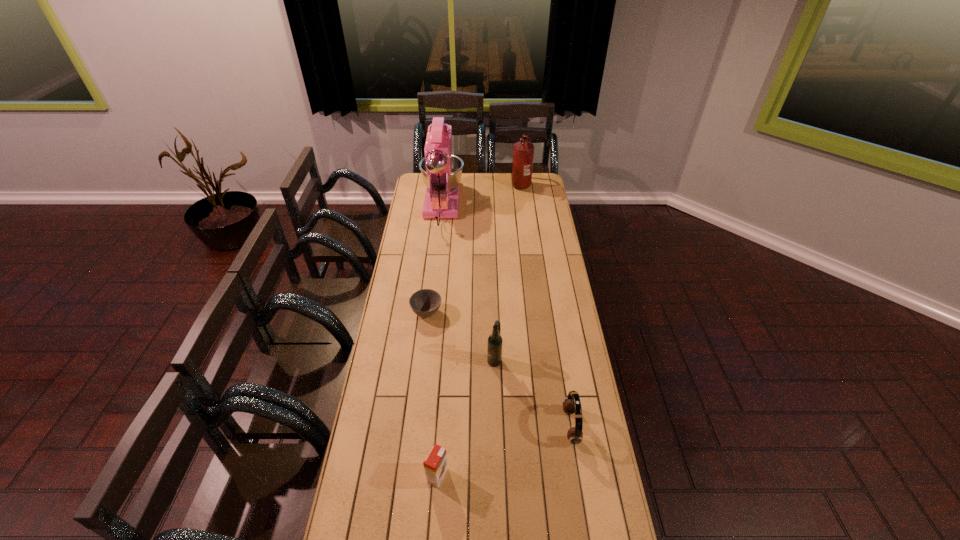
Where is `the tallest object`? the tallest object is located at coordinates (441, 171).

Locate an element on the screen. the second tallest object is located at coordinates (523, 152).

This screenshot has height=540, width=960. I want to click on the third nearest object, so click(x=494, y=347).

This screenshot has width=960, height=540. I want to click on the third tallest object, so click(x=494, y=347).

Locate an element on the screen. The width and height of the screenshot is (960, 540). the second nearest object is located at coordinates (571, 404).

The height and width of the screenshot is (540, 960). What are the coordinates of `orange juice` in the screenshot? It's located at (435, 464).

Locate an element on the screen. Image resolution: width=960 pixels, height=540 pixels. the shortest object is located at coordinates (425, 303).

Identify the location of bowl. (425, 303).

In order to click on free space located 0.050m on the face of the mixer in this screenshot , I will do `click(444, 178)`.

Image resolution: width=960 pixels, height=540 pixels. Identify the location of free spot located on the face of the mixer. (445, 176).